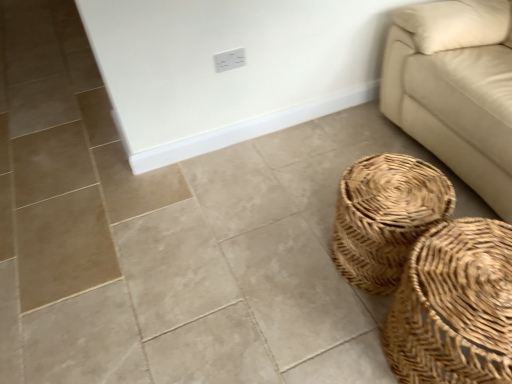
Question: Considering the relative sizes of white plastic electric outlet at upper center and beige leather couch at right in the image provided, is white plastic electric outlet at upper center bigger than beige leather couch at right?

Choices:
 (A) yes
 (B) no

Answer: (B)

Question: Considering the relative positions of white plastic electric outlet at upper center and beige leather couch at right in the image provided, is white plastic electric outlet at upper center to the left of beige leather couch at right from the viewer's perspective?

Choices:
 (A) no
 (B) yes

Answer: (B)

Question: From the image's perspective, would you say white plastic electric outlet at upper center is positioned over beige leather couch at right?

Choices:
 (A) yes
 (B) no

Answer: (A)

Question: Is white plastic electric outlet at upper center not inside beige leather couch at right?

Choices:
 (A) yes
 (B) no

Answer: (A)

Question: Is white plastic electric outlet at upper center looking in the opposite direction of beige leather couch at right?

Choices:
 (A) no
 (B) yes

Answer: (A)

Question: Is white plastic electric outlet at upper center surrounding beige leather couch at right?

Choices:
 (A) no
 (B) yes

Answer: (A)

Question: Is woven natural basket at lower right, the second basket viewed from the front, smaller than white plastic electric outlet at upper center?

Choices:
 (A) no
 (B) yes

Answer: (A)

Question: Is woven natural basket at lower right, which appears as the first basket when viewed from the back, to the right of white plastic electric outlet at upper center from the viewer's perspective?

Choices:
 (A) yes
 (B) no

Answer: (A)

Question: Is white plastic electric outlet at upper center a part of woven natural basket at lower right, the second basket viewed from the front?

Choices:
 (A) no
 (B) yes

Answer: (A)

Question: Does woven natural basket at lower right, which appears as the first basket when viewed from the back, have a lesser height compared to white plastic electric outlet at upper center?

Choices:
 (A) no
 (B) yes

Answer: (A)

Question: Would you say woven natural basket at lower right, which appears as the first basket when viewed from the back, is outside white plastic electric outlet at upper center?

Choices:
 (A) no
 (B) yes

Answer: (B)

Question: Considering the relative sizes of woven natural basket at lower right, the second basket viewed from the front, and white plastic electric outlet at upper center in the image provided, is woven natural basket at lower right, the second basket viewed from the front, bigger than white plastic electric outlet at upper center?

Choices:
 (A) yes
 (B) no

Answer: (A)

Question: From a real-world perspective, is woven natural basket at lower right, the second basket viewed from the front, positioned under woven natural basket at lower right, positioned as the 2th basket in back-to-front order, based on gravity?

Choices:
 (A) yes
 (B) no

Answer: (A)